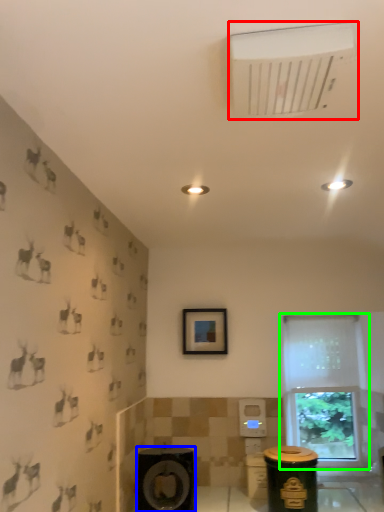
Question: Based on their relative distances, which object is farther from air conditioning (highlighted by a red box)? Choose from speaker (highlighted by a blue box) and window (highlighted by a green box).

Choices:
 (A) speaker
 (B) window

Answer: (B)